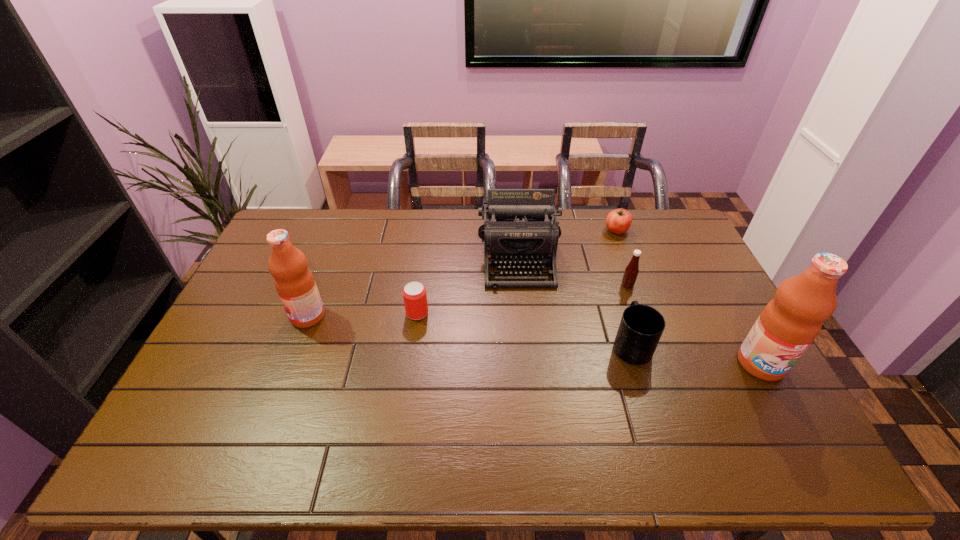
Where is `vacant area between the apple and the Tabasco sauce`? vacant area between the apple and the Tabasco sauce is located at coordinates (622, 258).

The width and height of the screenshot is (960, 540). Find the location of `vacant space that's between the left fruit juice and the nearer fruit juice`. vacant space that's between the left fruit juice and the nearer fruit juice is located at coordinates (535, 340).

The height and width of the screenshot is (540, 960). What are the coordinates of `free space between the fifth object from right to left and the sixth object from right to left` in the screenshot? It's located at (468, 285).

What are the coordinates of `blank region between the third object from left to right and the Tabasco sauce` in the screenshot? It's located at (573, 271).

You are a GUI agent. You are given a task and a screenshot of the screen. Output one action in this format:
    pyautogui.click(x=<x>, y=<y>)
    Task: Click on the free space between the fifth object from right to left and the apple
    
    Given the screenshot: What is the action you would take?
    pyautogui.click(x=567, y=244)

Locate an element on the screen. free space between the apple and the typewriter is located at coordinates (567, 244).

Locate an element on the screen. The width and height of the screenshot is (960, 540). free spot between the sixth shortest object and the beer can is located at coordinates (363, 315).

I want to click on free spot between the beer can and the leftmost object, so click(363, 315).

Find the location of a particular element. Image resolution: width=960 pixels, height=540 pixels. free space between the leftmost object and the Tabasco sauce is located at coordinates (468, 301).

I want to click on the fourth closest object to the second object from left to right, so click(x=631, y=272).